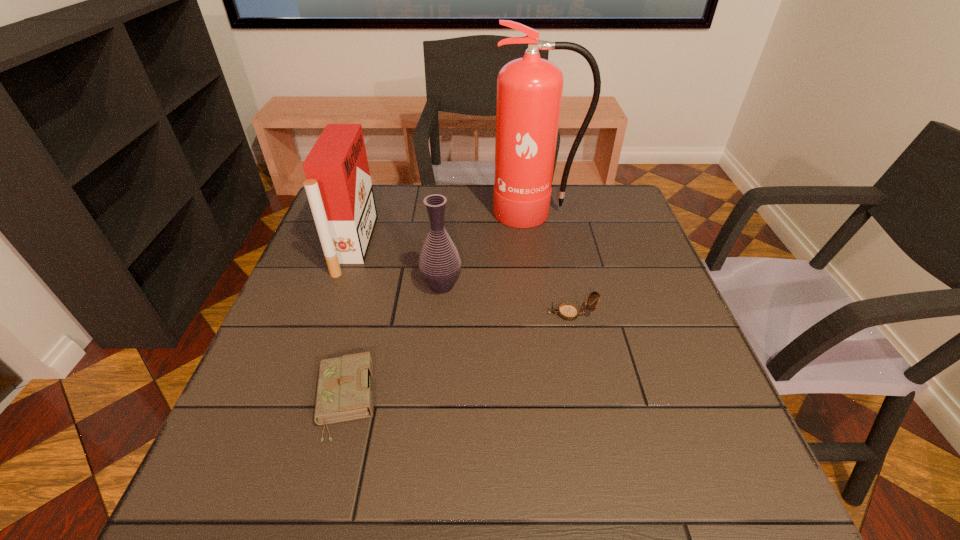
This screenshot has width=960, height=540. Identify the location of free space that satisfies the following two spatial constraints: 1. on the front-facing side of the cigarette case; 2. on the back side of the vase. (340, 286).

Locate an element on the screen. blank space that satisfies the following two spatial constraints: 1. on the front-facing side of the diary; 2. on the left side of the cigarette case is located at coordinates (300, 400).

Find the location of `vacant space that satisfies the following two spatial constraints: 1. on the front-facing side of the cigarette case; 2. on the back side of the shortest object`. vacant space that satisfies the following two spatial constraints: 1. on the front-facing side of the cigarette case; 2. on the back side of the shortest object is located at coordinates (300, 400).